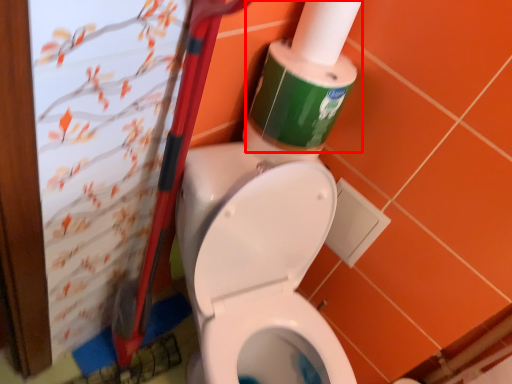
Question: From the image, what is the correct spatial relationship of cleaning product (annotated by the red box) in relation to toilet paper?

Choices:
 (A) left
 (B) right

Answer: (A)